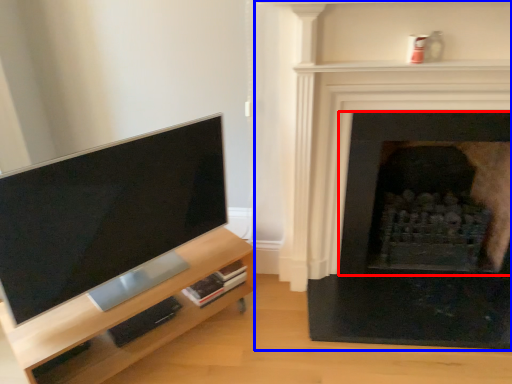
Question: Which of the following is the farthest to the observer, fireplace (highlighted by a red box) or fireplace (highlighted by a blue box)?

Choices:
 (A) fireplace
 (B) fireplace

Answer: (A)